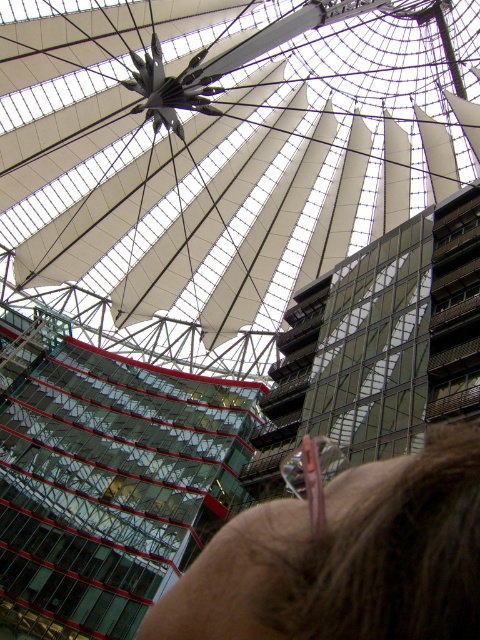
Question: Which point is closer to the camera taking this photo?

Choices:
 (A) (127, 195)
 (B) (442, 470)

Answer: (B)

Question: Which of the following is the farthest from the observer?

Choices:
 (A) brown hair at upper center
 (B) white fabric roof at center

Answer: (B)

Question: Can you confirm if white fabric roof at center is wider than brown hair at upper center?

Choices:
 (A) no
 (B) yes

Answer: (B)

Question: Is white fabric roof at center bigger than brown hair at upper center?

Choices:
 (A) yes
 (B) no

Answer: (A)

Question: Is white fabric roof at center further to camera compared to brown hair at upper center?

Choices:
 (A) yes
 (B) no

Answer: (A)